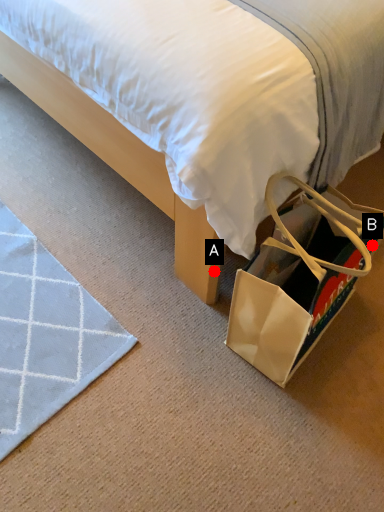
Question: Two points are circled on the image, labeled by A and B beside each circle. Which point is closer to the camera?

Choices:
 (A) A is closer
 (B) B is closer

Answer: (B)